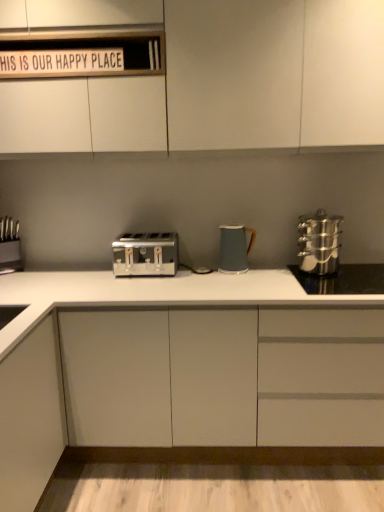
Question: Based on their positions, is white wood sign at upper center located to the left or right of white matte cabinet at center, placed as the first cabinetry when sorted from bottom to top?

Choices:
 (A) left
 (B) right

Answer: (A)

Question: From the image's perspective, is white wood sign at upper center above or below white matte cabinet at center, the second cabinetry from the top?

Choices:
 (A) above
 (B) below

Answer: (A)

Question: Based on their relative distances, which object is nearer to the matte gray kettle at center?

Choices:
 (A) white matte cabinet at center, the second cabinetry from the top
 (B) white matte cabinet at upper center, which appears as the second cabinetry when ordered from the bottom
 (C) stainless steel knife block at left
 (D) stainless steel steamer at right
 (E) white wood sign at upper center

Answer: (D)

Question: Considering the real-world distances, which object is closest to the stainless steel steamer at right?

Choices:
 (A) white matte cabinet at upper center, which appears as the second cabinetry when ordered from the bottom
 (B) matte gray kettle at center
 (C) white matte cabinet at center, placed as the first cabinetry when sorted from bottom to top
 (D) satin silver toaster at center
 (E) stainless steel knife block at left

Answer: (B)